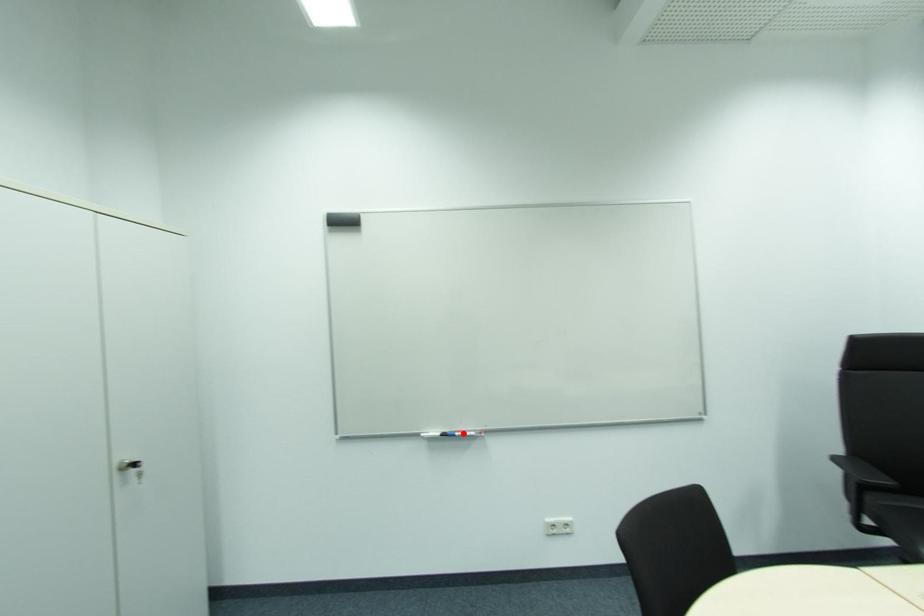
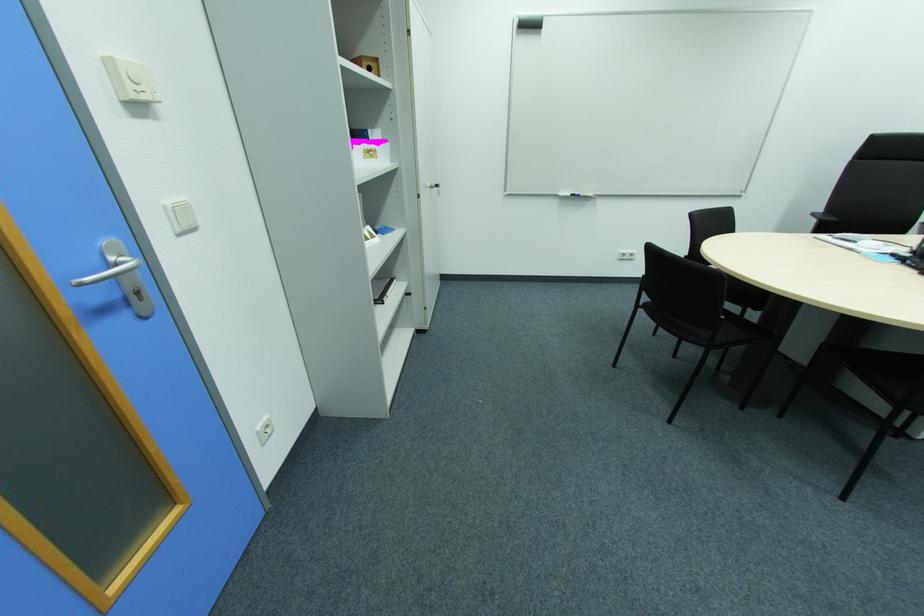
Question: I am providing you with two images of the same scene from different viewpoints. Image1 has a red point marked. In image2, the corresponding 3D location appears at what relative position? Reply with the corresponding letter.

Choices:
 (A) Closer
 (B) Farther

Answer: (A)